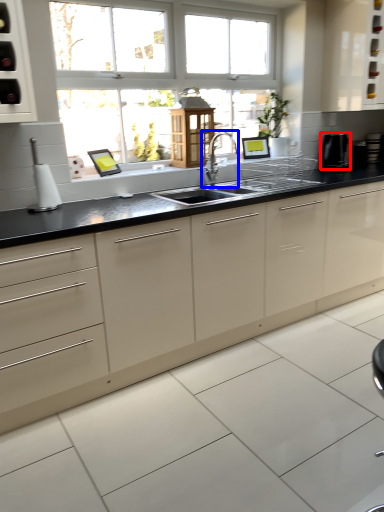
Question: Among these objects, which one is farthest to the camera, appliance (highlighted by a red box) or tap (highlighted by a blue box)?

Choices:
 (A) appliance
 (B) tap

Answer: (A)